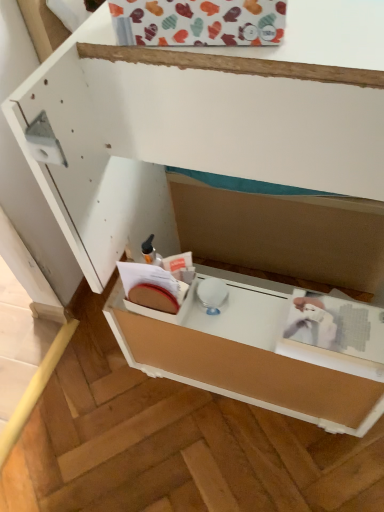
What do you see at coordinates (203, 21) in the screenshot? The width and height of the screenshot is (384, 512). I see `patterned cardboard box at upper center` at bounding box center [203, 21].

Measure the distance between point (x=172, y=42) and camera.

The depth of point (x=172, y=42) is 22.01 inches.

At what (x,y) coordinates should I click in order to perform the action: click on patterned cardboard box at upper center. Please return your answer as a coordinate pair (x, y). This screenshot has height=512, width=384. Looking at the image, I should click on (203, 21).

The image size is (384, 512). I want to click on patterned cardboard box at upper center, so click(x=203, y=21).